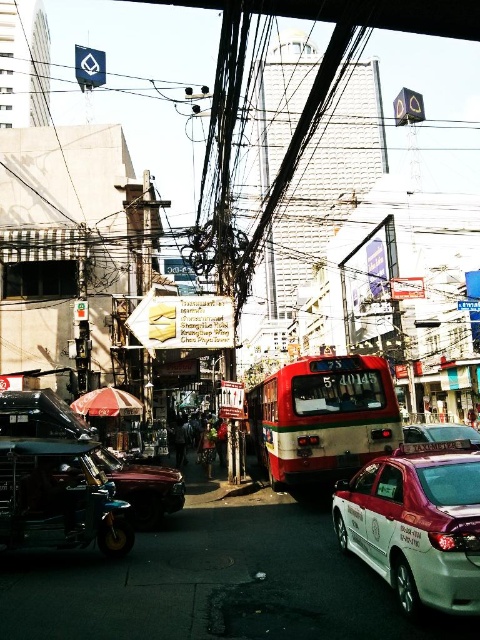
Looking at this image, is red matte bus at center to the right of dark blue fabric at center from the viewer's perspective?

Indeed, red matte bus at center is positioned on the right side of dark blue fabric at center.

Can you confirm if red matte bus at center is shorter than dark blue fabric at center?

Incorrect, red matte bus at center's height does not fall short of dark blue fabric at center's.

The image size is (480, 640). Identify the location of red matte bus at center. (323, 419).

You are a GUI agent. You are given a task and a screenshot of the screen. Output one action in this format:
    pyautogui.click(x=<x>, y=<y>)
    Task: Click on the red matte bus at center
    The height and width of the screenshot is (640, 480).
    Given the screenshot: What is the action you would take?
    point(323,419)

Can you confirm if metallic silver scooter at lower left is shorter than metallic silver taxi at center?

Yes.

Can you confirm if metallic silver scooter at lower left is positioned below metallic silver taxi at center?

Yes.

Locate an element on the screen. The height and width of the screenshot is (640, 480). metallic silver scooter at lower left is located at coordinates (59, 499).

You are a GUI agent. You are given a task and a screenshot of the screen. Output one action in this format:
    pyautogui.click(x=<x>, y=<y>)
    Task: Click on the metallic silver scooter at lower left
    
    Given the screenshot: What is the action you would take?
    pyautogui.click(x=59, y=499)

Can you confirm if white metallic taxi at center is positioned above metallic red scooter at lower left?

Yes.

Which is behind, point (444, 461) or point (180, 499)?

The point (180, 499) is more distant.

Between point (368, 470) and point (38, 397), which one is positioned behind?

Point (38, 397)

This screenshot has height=640, width=480. I want to click on white metallic taxi at center, so click(417, 524).